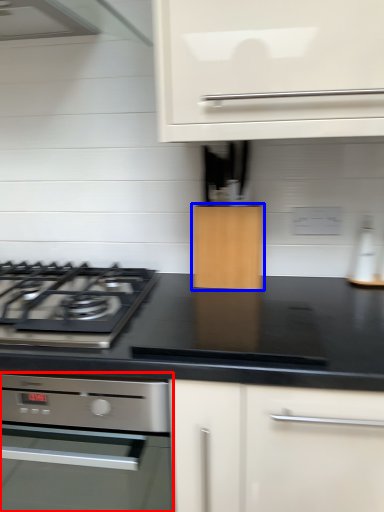
Question: Which of the following is the closest to the observer, home appliance (highlighted by a red box) or cabinetry (highlighted by a blue box)?

Choices:
 (A) home appliance
 (B) cabinetry

Answer: (A)